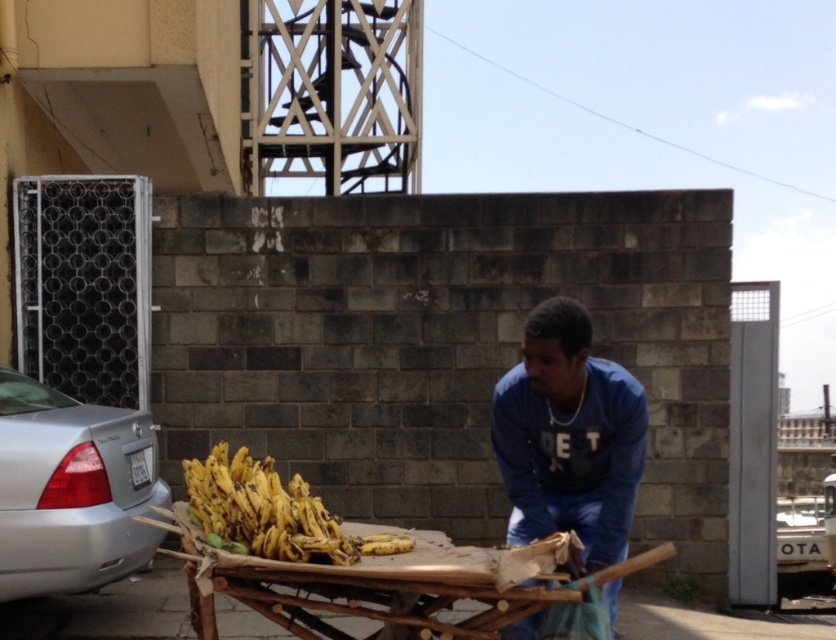
Looking at this image, you are a customer at a fruit stand. You see two bunches of yellow matte bananas at center and yellow matte bananas at lower center. Which bunch is more to the left?

The yellow matte bananas at center is positioned on the left side of yellow matte bananas at lower center, so the bunch at center is more to the left.

You are a customer at a fruit stand and want to buy bananas. You notice the blue cotton shirt at center and the yellow matte bananas at center. Which item is taller?

The blue cotton shirt at center is taller than the yellow matte bananas at center.

You are a customer wanting to buy bananas. You see the wooden bamboo cart at center and the yellow matte bananas at center. Which object is closer to you?

The wooden bamboo cart at center is closer to you because it is in front of the yellow matte bananas at center.